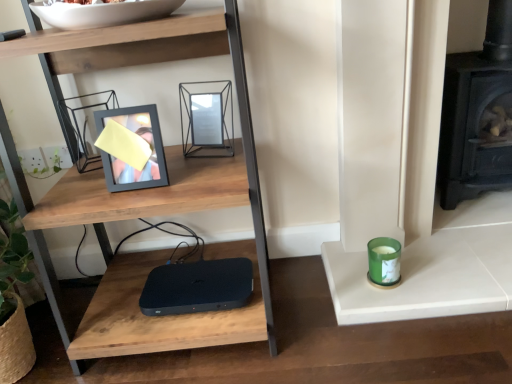
Question: Considering the positions of green glass candle at right and black cast iron fireplace at right in the image, is green glass candle at right wider or thinner than black cast iron fireplace at right?

Choices:
 (A) wide
 (B) thin

Answer: (B)

Question: From a real-world perspective, relative to black cast iron fireplace at right, is green glass candle at right vertically above or below?

Choices:
 (A) above
 (B) below

Answer: (B)

Question: Based on their relative distances, which object is nearer to the green glass candle at right?

Choices:
 (A) woodenmaterial/textureshelf at center
 (B) metallic geometric frame at upper center, which is the 2th picture frame in left-to-right order
 (C) white glossy bowl at upper center
 (D) black cast iron fireplace at right
 (E) matte black picture frame at upper left, marked as the first picture frame in a left-to-right arrangement

Answer: (D)

Question: Considering the real-world distances, which object is closest to the metallic geometric frame at upper center, acting as the 1th picture frame starting from the right?

Choices:
 (A) white glossy bowl at upper center
 (B) woodenmaterial/textureshelf at center
 (C) matte black picture frame at upper left, which appears as the second picture frame when viewed from the right
 (D) black matte router at center
 (E) green glass candle at right

Answer: (C)